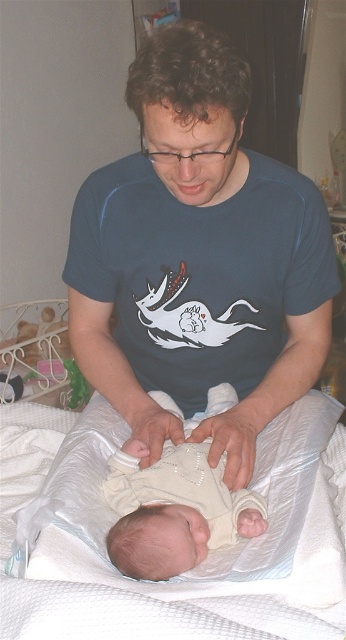
Question: Considering the real-world distances, which object is farthest from the light beige fabric newborn at center?

Choices:
 (A) white fabric infant bed at center
 (B) blue cotton shirt at center

Answer: (B)

Question: Where is blue cotton shirt at center located in relation to light beige fabric newborn at center in the image?

Choices:
 (A) right
 (B) left

Answer: (B)

Question: Considering the relative positions of white fabric infant bed at center and light beige fabric newborn at center in the image provided, where is white fabric infant bed at center located with respect to light beige fabric newborn at center?

Choices:
 (A) left
 (B) right

Answer: (A)

Question: Is blue cotton shirt at center to the left of light beige fabric newborn at center from the viewer's perspective?

Choices:
 (A) yes
 (B) no

Answer: (A)

Question: Which object appears farthest from the camera in this image?

Choices:
 (A) light beige fabric newborn at center
 (B) blue cotton shirt at center
 (C) white fabric infant bed at center

Answer: (A)

Question: Which of the following is the closest to the observer?

Choices:
 (A) pos(175,632)
 (B) pos(215,77)

Answer: (A)